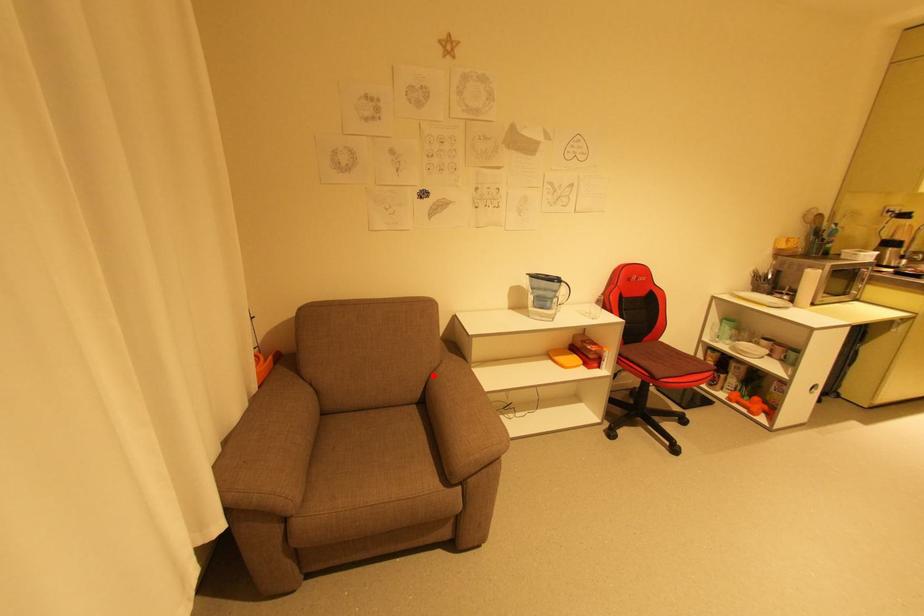
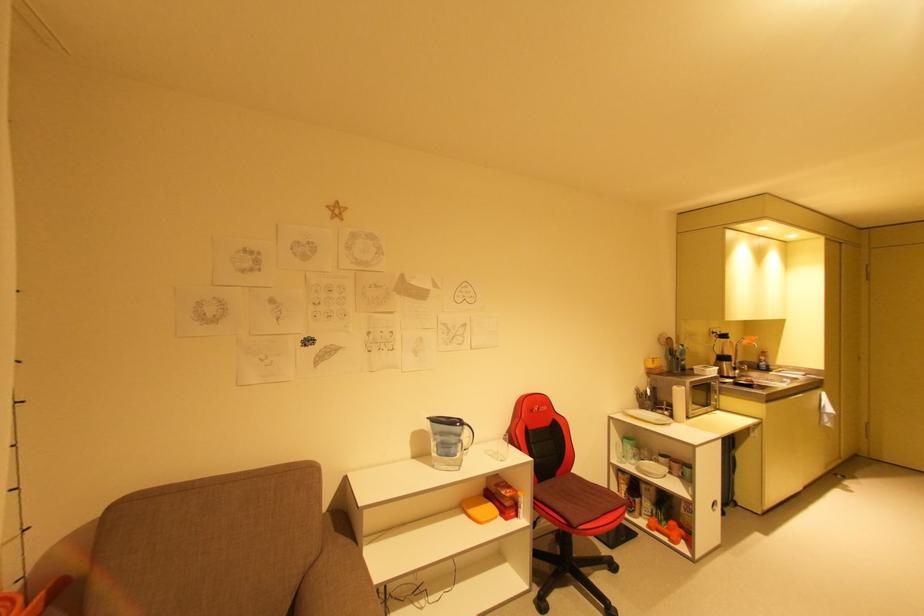
Locate, in the second image, the point that corresponds to the highlighted location in the first image.

(306, 578)